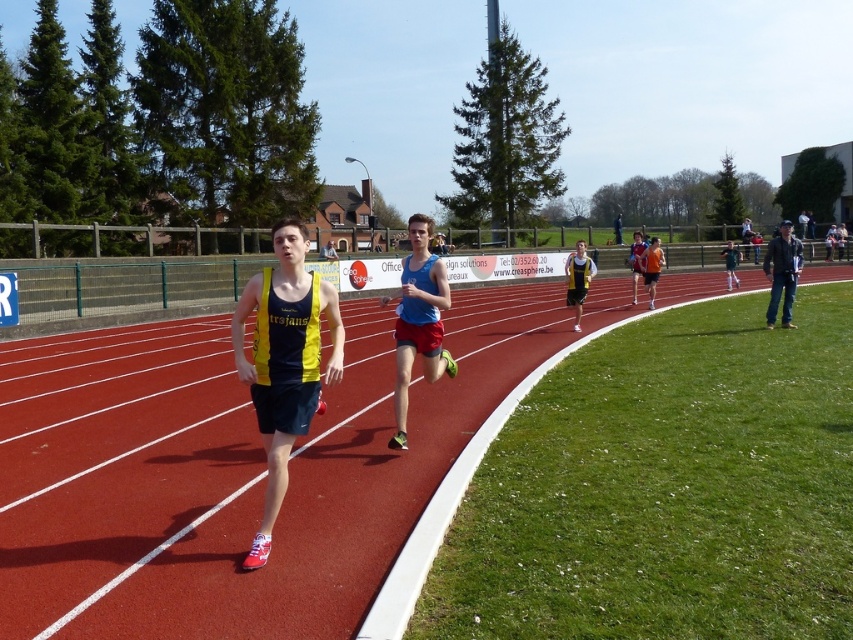
You are a photographer standing at the starting line of the athletics track. You want to take a photo of the yellow and blue athletic top at center. According to the coordinates provided, where should you aim your camera to capture it?

The yellow and blue athletic top at center is located at coordinates point (283, 360). To capture it, aim your camera at that specific coordinate point.

Based on the photo, you are a drone operator trying to capture aerial footage of the athletics track. You have two points marked on your screen for camera positioning. The first point is at coordinates point (427, 332) and the second at point (770, 312). Based on the scene description, which point would place the camera closer to the runners?

Point (427, 332) is closer to the viewer than point (770, 312), so positioning the camera at point (427, 332) would place it closer to the runners.

You are a photographer standing at the starting line of the athletics track. You want to take a photo that includes both the rubberized red track at center and the blue fabric tank top at center. Based on their positions, which object will appear closer to you in the photo?

The rubberized red track at center is in front of the blue fabric tank top at center, so it will appear closer to you in the photo.